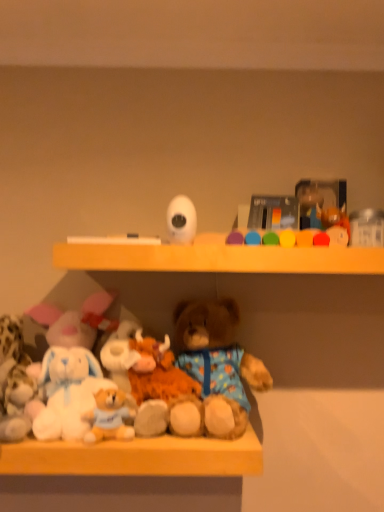
Question: From the image's perspective, would you say fluffy brown teddy bear at center is shown under white matte camera at upper center, acting as the fourth toy starting from the bottom?

Choices:
 (A) no
 (B) yes

Answer: (B)

Question: Is fluffy brown teddy bear at center oriented away from white matte camera at upper center, acting as the fourth toy starting from the bottom?

Choices:
 (A) yes
 (B) no

Answer: (B)

Question: Does fluffy brown teddy bear at center appear on the right side of white matte camera at upper center, the first toy positioned from the top?

Choices:
 (A) no
 (B) yes

Answer: (B)

Question: Is fluffy brown teddy bear at center smaller than white matte camera at upper center, acting as the fourth toy starting from the bottom?

Choices:
 (A) yes
 (B) no

Answer: (B)

Question: Is the surface of fluffy brown teddy bear at center in direct contact with white matte camera at upper center, which ranks as the 3th toy in left-to-right order?

Choices:
 (A) no
 (B) yes

Answer: (A)

Question: Based on their positions, is fluffy beige teddy bear at lower left, the second toy from the left, located to the left or right of white plush toys at lower center?

Choices:
 (A) left
 (B) right

Answer: (A)

Question: From their relative heights in the image, would you say fluffy beige teddy bear at lower left, which is the third toy from right to left, is taller or shorter than white plush toys at lower center?

Choices:
 (A) short
 (B) tall

Answer: (B)

Question: Is fluffy beige teddy bear at lower left, the fourth toy positioned from the top, in front of or behind white plush toys at lower center in the image?

Choices:
 (A) front
 (B) behind

Answer: (B)

Question: In terms of width, does fluffy beige teddy bear at lower left, which is the first toy from bottom to top, look wider or thinner when compared to white plush toys at lower center?

Choices:
 (A) thin
 (B) wide

Answer: (A)

Question: From a real-world perspective, is white plush toys at lower center physically located above or below glossy plastic toy at upper center, placed as the fourth toy when sorted from left to right?

Choices:
 (A) below
 (B) above

Answer: (A)

Question: Considering the positions of point (29, 459) and point (299, 243), is point (29, 459) closer or farther from the camera than point (299, 243)?

Choices:
 (A) closer
 (B) farther

Answer: (A)

Question: Which is correct: white plush toys at lower center is inside glossy plastic toy at upper center, which is the 2th toy from top to bottom, or outside of it?

Choices:
 (A) inside
 (B) outside

Answer: (B)

Question: Considering the positions of white plush toys at lower center and glossy plastic toy at upper center, which is the 2th toy from top to bottom, in the image, is white plush toys at lower center bigger or smaller than glossy plastic toy at upper center, which is the 2th toy from top to bottom,?

Choices:
 (A) small
 (B) big

Answer: (B)

Question: Is white matte camera at upper center, the first toy positioned from the top, to the left or to the right of fluffy white stuffed animal at lower left, arranged as the 4th toy when viewed from the right, in the image?

Choices:
 (A) right
 (B) left

Answer: (A)

Question: Is white matte camera at upper center, the first toy positioned from the top, in front of or behind fluffy white stuffed animal at lower left, acting as the first toy starting from the left, in the image?

Choices:
 (A) front
 (B) behind

Answer: (A)